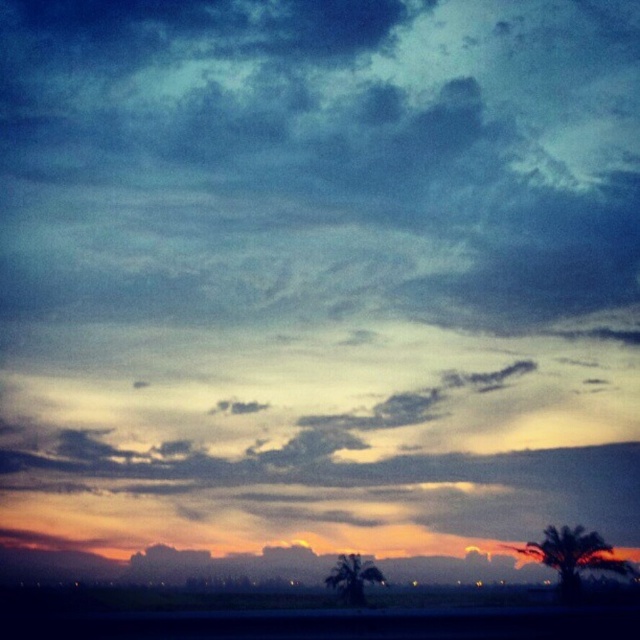
You are standing in the sunset scene and want to take a photo of the green leafy palm tree at lower right. If the center of your camera viewfinder is at coordinate point 0.5, 0.5, what direction should you move the camera to frame the palm tree?

The green leafy palm tree at lower right is located at coordinate point [573,556]. Since the camera viewfinder center is at [320,320], you need to move the camera to the right and slightly upward to align the palm tree at the center.

You are standing in the sunset scene and want to walk towards the green leafy palm tree at lower right. Which direction should you move relative to the green leafy palm tree at lower center?

The green leafy palm tree at lower right is to the right of the green leafy palm tree at lower center. To reach it, you should move towards the right direction from the green leafy palm tree at lower center.

Based on the photo, you are a bird flying over the sunset scene. You want to land on the tallest palm tree. Which one should you choose between the green leafy palm tree at lower right and the green leafy palm tree at lower center?

The green leafy palm tree at lower right is larger in size compared to the green leafy palm tree at lower center, so you should choose the green leafy palm tree at lower right to land on.